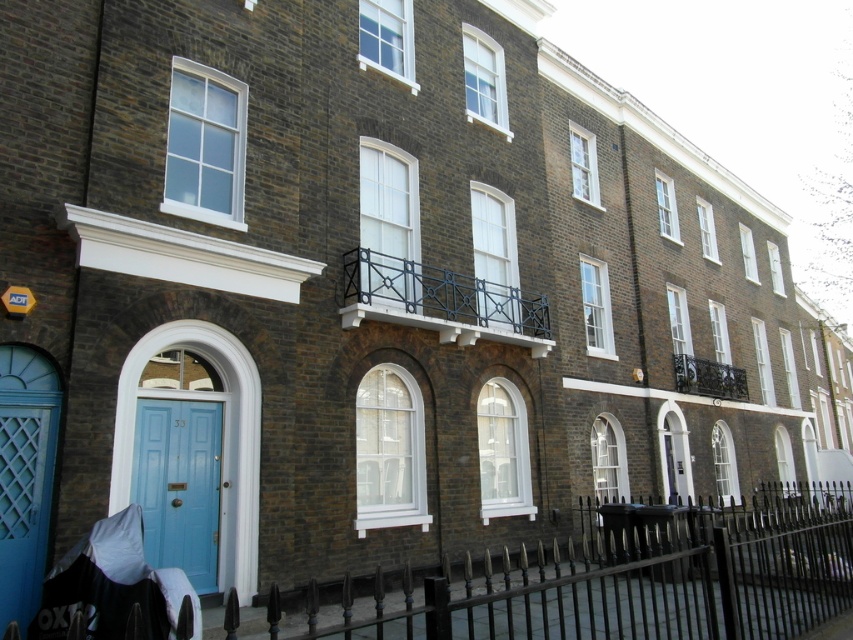
Is black wrought iron fence at lower center taller than black fabric baby carriage at lower left?

Yes.

Is black wrought iron fence at lower center thinner than black fabric baby carriage at lower left?

No, black wrought iron fence at lower center is not thinner than black fabric baby carriage at lower left.

Does point (766, 573) come behind point (39, 612)?

Yes, point (766, 573) is farther from viewer.

The height and width of the screenshot is (640, 853). In order to click on black wrought iron fence at lower center in this screenshot , I will do `click(618, 579)`.

Between point (776, 586) and point (180, 458), which one is positioned behind?

The point (776, 586) is more distant.

This screenshot has height=640, width=853. Describe the element at coordinates (618, 579) in the screenshot. I see `black wrought iron fence at lower center` at that location.

Between point (657, 632) and point (199, 476), which one is positioned behind?

Positioned behind is point (199, 476).

Where is `black wrought iron fence at lower center`? The image size is (853, 640). black wrought iron fence at lower center is located at coordinates (618, 579).

Based on the photo, is matte blue door at left further to camera compared to black fabric baby carriage at lower left?

Yes, matte blue door at left is behind black fabric baby carriage at lower left.

Can you confirm if matte blue door at left is taller than black fabric baby carriage at lower left?

Yes, matte blue door at left is taller than black fabric baby carriage at lower left.

Describe the element at coordinates (178, 484) in the screenshot. I see `matte blue door at left` at that location.

Find the location of a particular element. Image resolution: width=853 pixels, height=640 pixels. matte blue door at left is located at coordinates (178, 484).